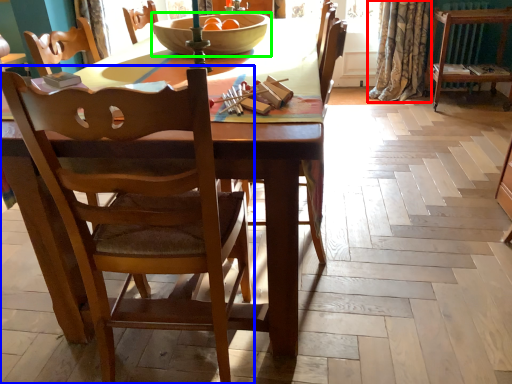
Question: Which is farther away from curtain (highlighted by a red box)? chair (highlighted by a blue box) or bowl (highlighted by a green box)?

Choices:
 (A) chair
 (B) bowl

Answer: (A)